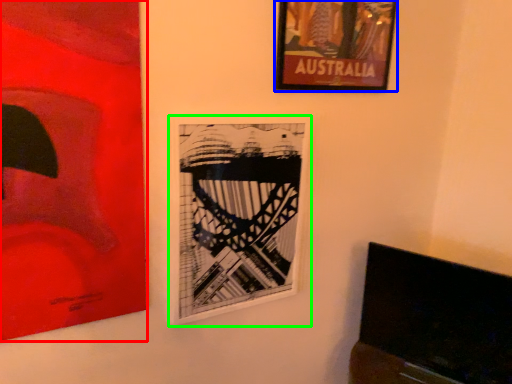
Question: Based on their relative distances, which object is nearer to picture frame (highlighted by a red box)? Choose from picture frame (highlighted by a blue box) and picture frame (highlighted by a green box).

Choices:
 (A) picture frame
 (B) picture frame

Answer: (B)